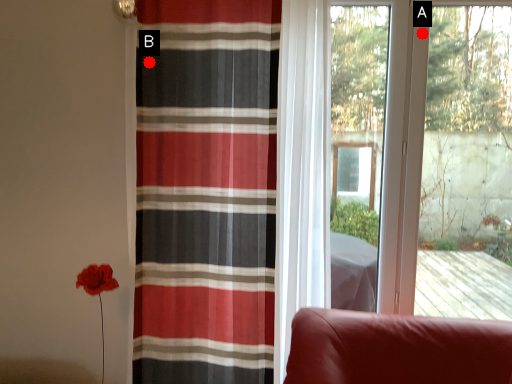
Question: Two points are circled on the image, labeled by A and B beside each circle. Which point is farther from the camera taking this photo?

Choices:
 (A) A is further
 (B) B is further

Answer: (A)